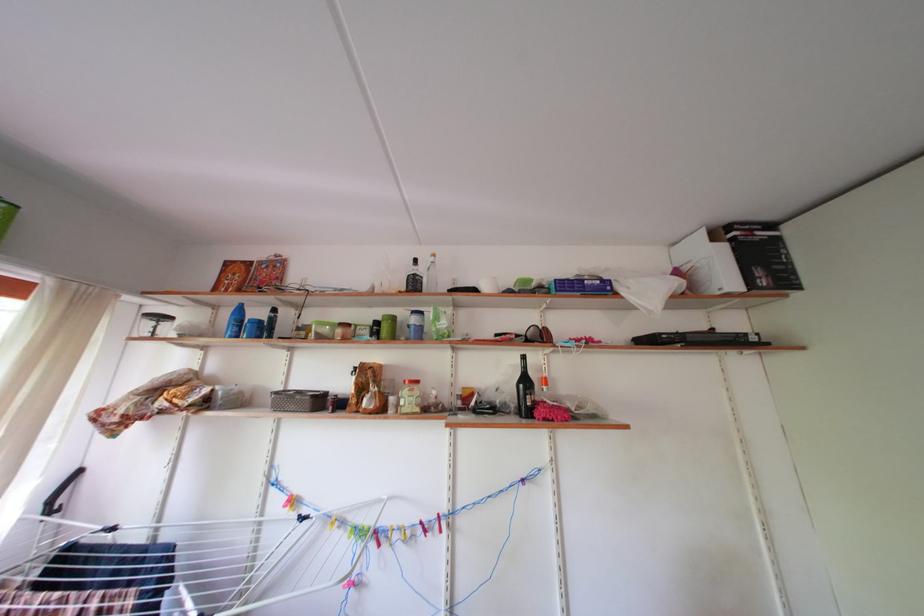
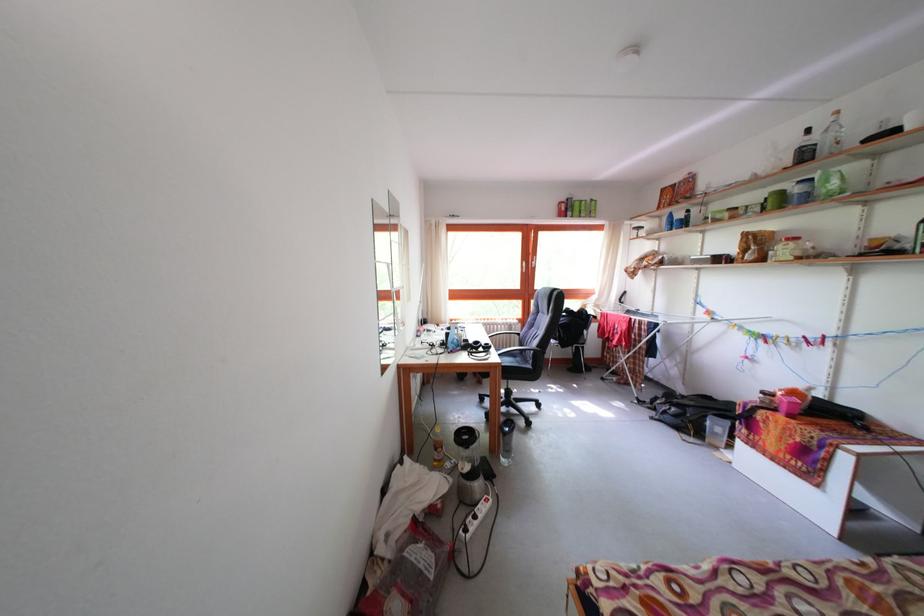
The point at (390, 373) is marked in the first image. Where is the corresponding point in the second image?

(783, 238)